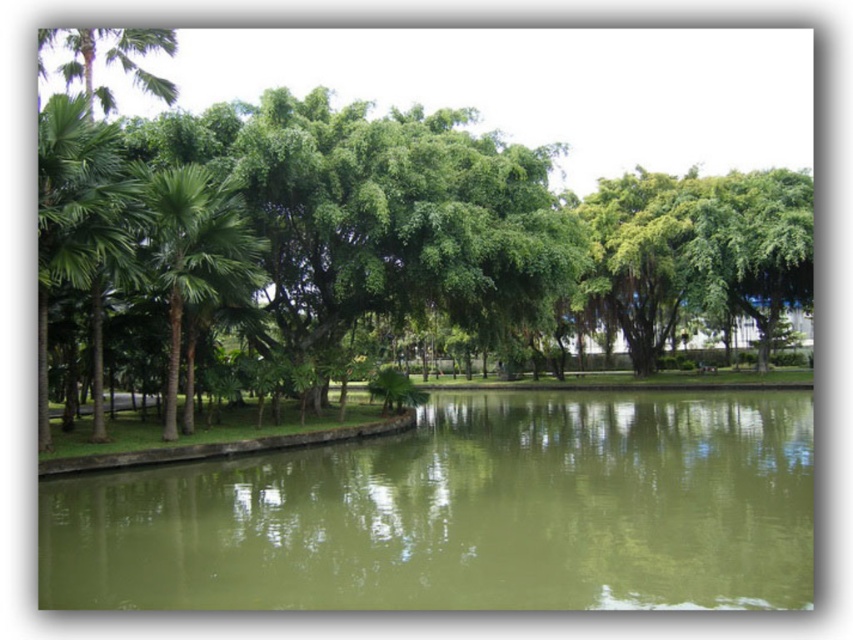
You are a park ranger who needs to place a 15 feet long wooden bridge between the green murky water at center and the green leafy palm tree at left. Based on the scene description, will the bridge fit perfectly between them without any adjustments?

The distance between the green murky water at center and the green leafy palm tree at left is 16.69 feet. Since the bridge is 15 feet long, it will fit with a remaining space of approximately 1.69 feet between them.

You are standing in the park and want to take a photo of the green leafy palm tree at left and the green murky water at center. Which object should you focus on first to ensure both are in focus?

You should focus on the green leafy palm tree at left first because it is further away from the viewer compared to the green murky water at center, so adjusting focus starting from the distant object ensures both can be in focus.

You are standing in the park and want to take a photo of the green leafy palm tree at left and the green murky water at center. Which object is positioned lower in the image?

The green murky water at center is located below the green leafy palm tree at left, so it is positioned lower in the image.